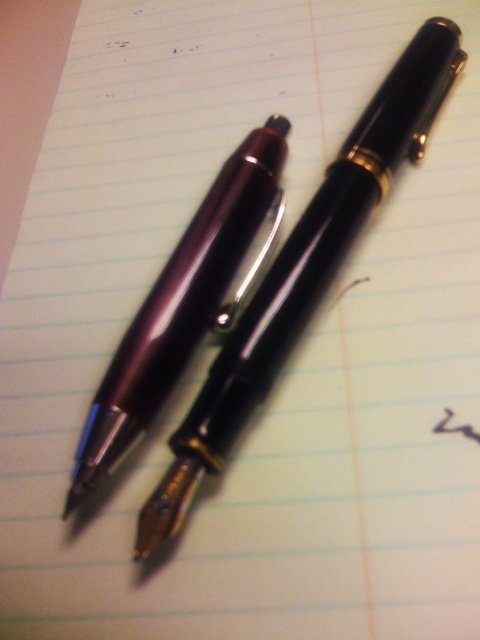
You have two pens on a notebook page. The matte black pen at upper center and the matte purple pen at center. Which one is wider?

The matte black pen at upper center is wider than the matte purple pen at center.

Consider the image. You are holding a ruler and want to measure the distance between the matte black pen at upper center and the matte purple pen at center. Which pen should you place the ruler closer to your eye level to measure accurately?

The matte black pen at upper center is closer to the viewer than the matte purple pen at center, so you should place the ruler closer to your eye level near the matte black pen at upper center to measure the distance accurately.